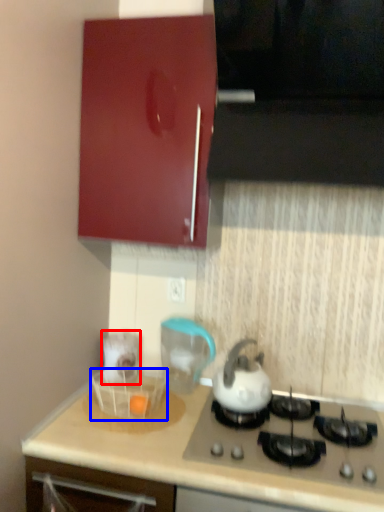
Question: Which object appears farthest to the camera in this image, appliance (highlighted by a red box) or basket (highlighted by a blue box)?

Choices:
 (A) appliance
 (B) basket

Answer: (A)